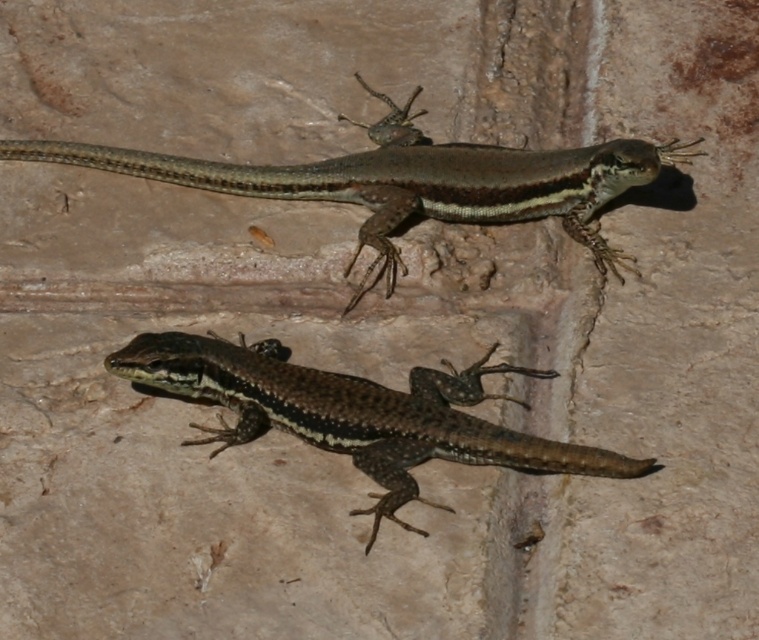
Is brown matte lizard at upper center below brown scaly lizard at center?

No.

You are a GUI agent. You are given a task and a screenshot of the screen. Output one action in this format:
    pyautogui.click(x=<x>, y=<y>)
    Task: Click on the brown matte lizard at upper center
    
    Given the screenshot: What is the action you would take?
    pyautogui.click(x=411, y=180)

Identify the location of brown matte lizard at upper center. Image resolution: width=759 pixels, height=640 pixels. (411, 180).

Locate an element on the screen. The width and height of the screenshot is (759, 640). brown matte lizard at upper center is located at coordinates (411, 180).